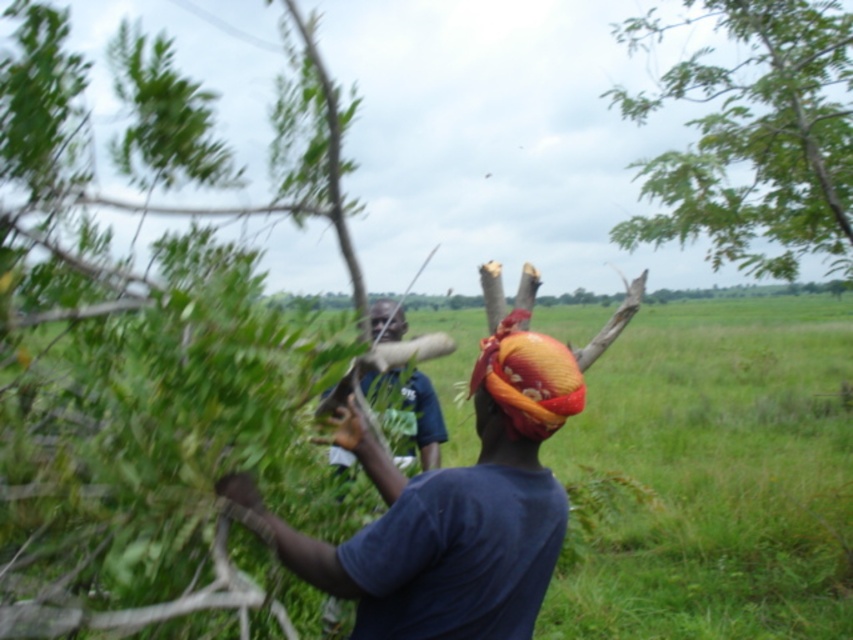
Question: From the image, what is the correct spatial relationship of orange fabric headscarf at center in relation to matte blue shirt at center?

Choices:
 (A) left
 (B) right

Answer: (B)

Question: Which point appears farthest from the camera in this image?

Choices:
 (A) (699, 17)
 (B) (392, 515)
 (C) (376, 300)

Answer: (A)

Question: Estimate the real-world distances between objects in this image. Which object is closer to the orange fabric headscarf at center?

Choices:
 (A) blue fabric shirt at center
 (B) dark blue t-shirt at center

Answer: (B)

Question: Can you confirm if dark blue t-shirt at center is positioned below matte blue shirt at center?

Choices:
 (A) yes
 (B) no

Answer: (A)

Question: Among these objects, which one is nearest to the camera?

Choices:
 (A) matte blue shirt at center
 (B) blue fabric shirt at center
 (C) orange fabric headscarf at center

Answer: (C)

Question: Considering the relative positions of dark blue t-shirt at center and matte blue shirt at center in the image provided, where is dark blue t-shirt at center located with respect to matte blue shirt at center?

Choices:
 (A) left
 (B) right

Answer: (B)